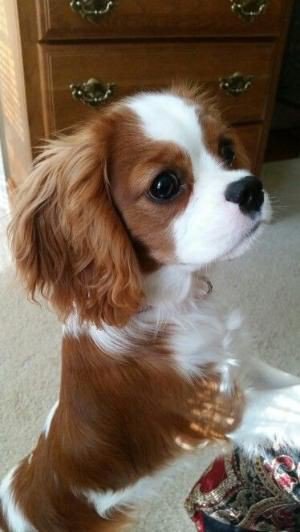
Where is `left side of dresser`? Image resolution: width=300 pixels, height=532 pixels. left side of dresser is located at coordinates (9, 11), (19, 161), (6, 95).